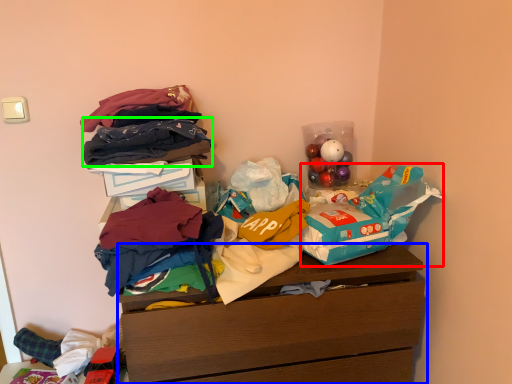
Question: Which is farther away from grocery bag (highlighted by a red box)? chest of drawers (highlighted by a blue box) or clothing (highlighted by a green box)?

Choices:
 (A) chest of drawers
 (B) clothing

Answer: (B)